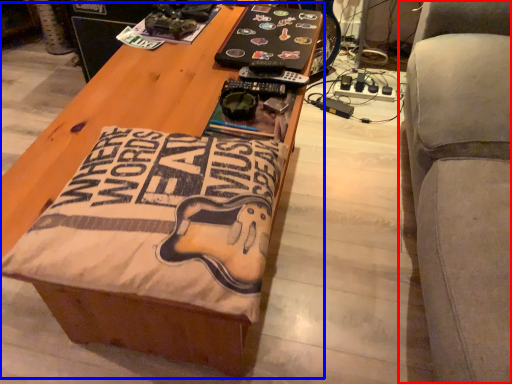
Question: Among these objects, which one is farthest to the camera, furniture (highlighted by a red box) or table (highlighted by a blue box)?

Choices:
 (A) furniture
 (B) table

Answer: (B)